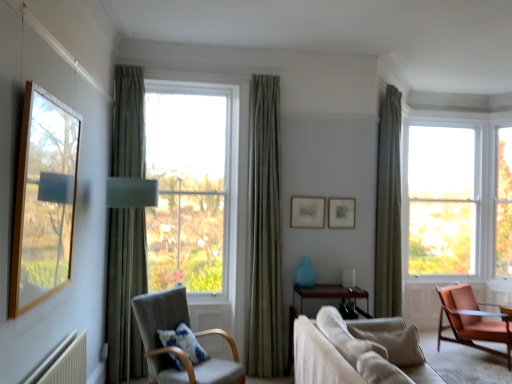
Locate an element on the screen. The width and height of the screenshot is (512, 384). teal matte vase at center is located at coordinates (306, 274).

This screenshot has width=512, height=384. I want to click on clear glass window at right, acting as the 3th window starting from the left, so click(x=504, y=204).

The height and width of the screenshot is (384, 512). Describe the element at coordinates (191, 184) in the screenshot. I see `clear glass window at center, positioned as the third window in back-to-front order` at that location.

At what (x,y) coordinates should I click in order to perform the action: click on clear glass window at center, the 1th window viewed from the left. Please return your answer as a coordinate pair (x, y). The image size is (512, 384). Looking at the image, I should click on (191, 184).

The height and width of the screenshot is (384, 512). In order to click on orange leather chair at right, the 2th chair from the left in this screenshot , I will do `click(472, 320)`.

At what (x,y) coordinates should I click in order to perform the action: click on teal matte vase at center. Please return your answer as a coordinate pair (x, y). Image resolution: width=512 pixels, height=384 pixels. Looking at the image, I should click on 306,274.

Looking at this image, is the position of matte wooden picture frame at center, acting as the second picture frame starting from the right, less distant than that of blue textured pillow at lower center, acting as the first pillow starting from the front?

No, it is not.

Does matte wooden picture frame at center, acting as the second picture frame starting from the right, have a greater height compared to blue textured pillow at lower center, acting as the first pillow starting from the front?

Yes, matte wooden picture frame at center, acting as the second picture frame starting from the right, is taller than blue textured pillow at lower center, acting as the first pillow starting from the front.

Is blue textured pillow at lower center, acting as the first pillow starting from the front, at the back of matte wooden picture frame at center, acting as the second picture frame starting from the right?

No.

Considering their positions, is clear glass window at center, positioned as the third window in back-to-front order, located in front of or behind green velvet curtain at left, the third curtain in the right-to-left sequence?

Clearly, clear glass window at center, positioned as the third window in back-to-front order, is behind green velvet curtain at left, the third curtain in the right-to-left sequence.

Is clear glass window at center, the 1th window viewed from the left, with green velvet curtain at left, the third curtain in the right-to-left sequence?

No, clear glass window at center, the 1th window viewed from the left, is not with green velvet curtain at left, the third curtain in the right-to-left sequence.

Considering the relative positions of clear glass window at center, marked as the third window in a right-to-left arrangement, and green velvet curtain at left, the 3th curtain when ordered from back to front, in the image provided, is clear glass window at center, marked as the third window in a right-to-left arrangement, to the left or to the right of green velvet curtain at left, the 3th curtain when ordered from back to front,?

From the image, it's evident that clear glass window at center, marked as the third window in a right-to-left arrangement, is to the right of green velvet curtain at left, the 3th curtain when ordered from back to front.

Do you think clear glass window at center, positioned as the third window in back-to-front order, is within green velvet curtain at left, acting as the 1th curtain starting from the left, or outside of it?

The correct answer is: outside.

From the image's perspective, which is below, blue textured pillow at center, acting as the first pillow starting from the back, or blue textured pillow at lower center, placed as the 1th pillow when sorted from right to left?

blue textured pillow at center, acting as the first pillow starting from the back, appears lower in the image.

At what (x,y) coordinates should I click in order to perform the action: click on pillow that appears below the blue textured pillow at lower center, placed as the 1th pillow when sorted from right to left (from a real-world perspective). Please return your answer as a coordinate pair (x, y). Looking at the image, I should click on (184, 342).

In terms of height, does blue textured pillow at center, which ranks as the 2th pillow in right-to-left order, look taller or shorter compared to blue textured pillow at lower center, placed as the 2th pillow when sorted from back to front?

In the image, blue textured pillow at center, which ranks as the 2th pillow in right-to-left order, appears to be taller than blue textured pillow at lower center, placed as the 2th pillow when sorted from back to front.

Is the position of green velvet curtain at left, the 3th curtain when ordered from back to front, less distant than that of green textured curtain at center, which is the 2th curtain in front-to-back order?

Yes, green velvet curtain at left, the 3th curtain when ordered from back to front, is closer to the camera.

Could you tell me if green velvet curtain at left, the 3th curtain when ordered from back to front, is facing green textured curtain at center, arranged as the 2th curtain when viewed from the back?

No, green velvet curtain at left, the 3th curtain when ordered from back to front, does not turn towards green textured curtain at center, arranged as the 2th curtain when viewed from the back.

Does green velvet curtain at left, acting as the 1th curtain starting from the left, have a lesser height compared to green textured curtain at center, arranged as the 2th curtain when viewed from the back?

No, green velvet curtain at left, acting as the 1th curtain starting from the left, is not shorter than green textured curtain at center, arranged as the 2th curtain when viewed from the back.

From a real-world perspective, count 1st curtains upward from the blue textured pillow at lower center, acting as the first pillow starting from the front, and point to it. Please provide its 2D coordinates.

[(125, 293)]

Are green velvet curtain at left, the 3th curtain when ordered from back to front, and blue textured pillow at lower center, marked as the second pillow in a bottom-to-top arrangement, far apart?

Yes, green velvet curtain at left, the 3th curtain when ordered from back to front, is far from blue textured pillow at lower center, marked as the second pillow in a bottom-to-top arrangement.

From a real-world perspective, who is located higher, green velvet curtain at left, the third curtain in the right-to-left sequence, or blue textured pillow at lower center, which ranks as the second pillow in left-to-right order?

From a 3D spatial view, green velvet curtain at left, the third curtain in the right-to-left sequence, is above.

How different are the orientations of green velvet curtain at left, acting as the 1th curtain starting from the left, and blue textured pillow at lower center, acting as the first pillow starting from the front, in degrees?

There is a 94.4-degree angle between the facing directions of green velvet curtain at left, acting as the 1th curtain starting from the left, and blue textured pillow at lower center, acting as the first pillow starting from the front.

Which object is positioned more to the left, matte silver picture frame at upper center, positioned as the 1th picture frame in right-to-left order, or clear glass window at right, marked as the 2th window in a front-to-back arrangement?

matte silver picture frame at upper center, positioned as the 1th picture frame in right-to-left order.

How many degrees apart are the facing directions of matte silver picture frame at upper center, positioned as the 1th picture frame in right-to-left order, and clear glass window at right, acting as the 3th window starting from the left?

matte silver picture frame at upper center, positioned as the 1th picture frame in right-to-left order, and clear glass window at right, acting as the 3th window starting from the left, are facing 50.8 degrees away from each other.

Considering the relative sizes of matte silver picture frame at upper center, acting as the 2th picture frame starting from the left, and clear glass window at right, marked as the 2th window in a front-to-back arrangement, in the image provided, is matte silver picture frame at upper center, acting as the 2th picture frame starting from the left, taller than clear glass window at right, marked as the 2th window in a front-to-back arrangement,?

No.

Is clear glass window at right, which is counted as the second window, starting from the back, at the back of matte silver picture frame at upper center, positioned as the 1th picture frame in right-to-left order?

No, matte silver picture frame at upper center, positioned as the 1th picture frame in right-to-left order,'s orientation is not away from clear glass window at right, which is counted as the second window, starting from the back.

Is clear glass window at right, the first window from the right, positioned far away from green textured curtain at center, acting as the second curtain starting from the right?

Yes, clear glass window at right, the first window from the right, and green textured curtain at center, acting as the second curtain starting from the right, are located far from each other.

Considering their positions, is clear glass window at right, the first window from the right, located in front of or behind green textured curtain at center, arranged as the 2th curtain when viewed from the back?

In the image, clear glass window at right, the first window from the right, appears behind green textured curtain at center, arranged as the 2th curtain when viewed from the back.

From the image's perspective, count 2nd picture frames upward from the blue textured pillow at lower center, acting as the first pillow starting from the front, and point to it. Please provide its 2D coordinates.

[(307, 212)]

Find the location of `curtain on the left of clear glass window at center, positioned as the third window in back-to-front order`. curtain on the left of clear glass window at center, positioned as the third window in back-to-front order is located at coordinates (125, 293).

Which object lies further to the anchor point blue textured pillow at center, which is the 1th pillow from bottom to top, orange leather chair at right, the first chair positioned from the back, or beige fabric couch at lower right?

orange leather chair at right, the first chair positioned from the back, lies further to blue textured pillow at center, which is the 1th pillow from bottom to top, than the other object.

Based on their spatial positions, is orange leather chair at right, the first chair positioned from the back, or clear glass window at right, acting as the second window starting from the right, further from teal matte vase at center?

clear glass window at right, acting as the second window starting from the right.

Based on their spatial positions, is blue textured pillow at center, which is the 1th pillow from bottom to top, or light gray fabric chair at center-left, which appears as the first chair when viewed from the front, further from teal matte vase at center?

Based on the image, light gray fabric chair at center-left, which appears as the first chair when viewed from the front, appears to be further to teal matte vase at center.

From the image, which object appears to be farther from matte wooden picture frame at center, acting as the second picture frame starting from the right, matte blue glass table lamp at center or clear glass window at right, marked as the 2th window in a front-to-back arrangement?

Based on the image, clear glass window at right, marked as the 2th window in a front-to-back arrangement, appears to be further to matte wooden picture frame at center, acting as the second picture frame starting from the right.

Based on their spatial positions, is matte wooden picture frame at center, which ranks as the first picture frame in left-to-right order, or beige fabric couch at lower right closer to orange leather chair at right, the 2th chair from the left?

Among the two, matte wooden picture frame at center, which ranks as the first picture frame in left-to-right order, is located nearer to orange leather chair at right, the 2th chair from the left.

From the image, which object appears to be farther from matte wooden picture frame at center, acting as the second picture frame starting from the right, green textured curtain at center, acting as the second curtain starting from the right, or beige fabric couch at lower right?

The object further to matte wooden picture frame at center, acting as the second picture frame starting from the right, is beige fabric couch at lower right.

When comparing their distances from matte blue glass table lamp at center, does beige fabric couch at lower right or matte silver picture frame at upper center, positioned as the 1th picture frame in right-to-left order, seem closer?

matte silver picture frame at upper center, positioned as the 1th picture frame in right-to-left order, lies closer to matte blue glass table lamp at center than the other object.

When comparing their distances from beige fabric couch at lower right, does matte wooden picture frame at center, which ranks as the first picture frame in left-to-right order, or clear glass window at right, acting as the second window starting from the left, seem further?

Among the two, clear glass window at right, acting as the second window starting from the left, is located further to beige fabric couch at lower right.

The height and width of the screenshot is (384, 512). What are the coordinates of `picture frame situated between green velvet curtain at left, the third curtain in the right-to-left sequence, and blue textured pillow at lower center, acting as the first pillow starting from the front, from left to right` in the screenshot? It's located at (307, 212).

Locate an element on the screen. This screenshot has height=384, width=512. teal between blue textured pillow at center, which is the 1th pillow from bottom to top, and beige fabric couch at lower right, in the horizontal direction is located at coordinates (306, 274).

Find the location of a particular element. curtain between clear glass window at center, positioned as the third window in back-to-front order, and teal matte vase at center, in the horizontal direction is located at coordinates (264, 233).

Locate an element on the screen. The width and height of the screenshot is (512, 384). pillow between green velvet curtain at left, acting as the 1th curtain starting from the left, and teal matte vase at center is located at coordinates (184, 342).